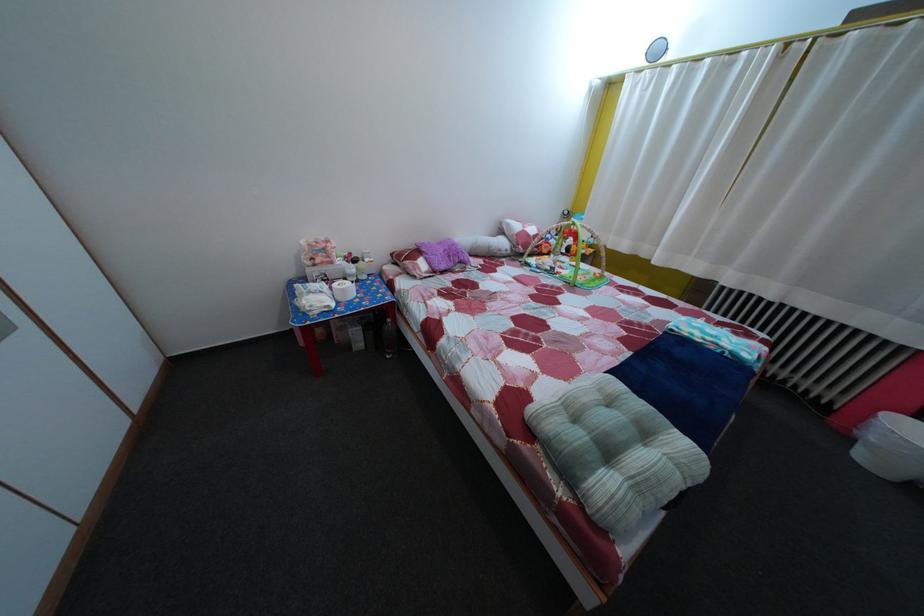
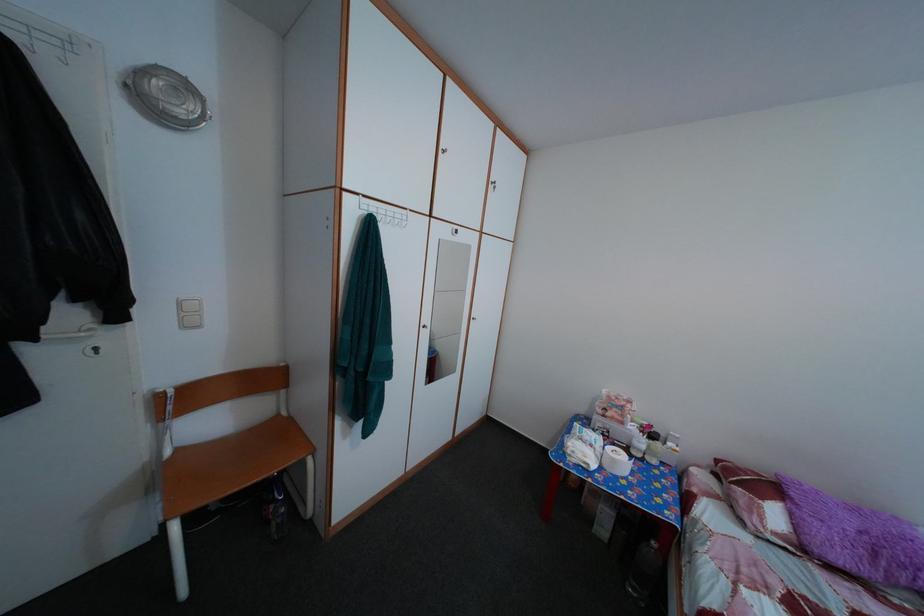
Question: The first image is from the beginning of the video and the second image is from the end. How did the camera likely rotate when shooting the video?

Choices:
 (A) Left
 (B) Right
 (C) Up
 (D) Down

Answer: (A)